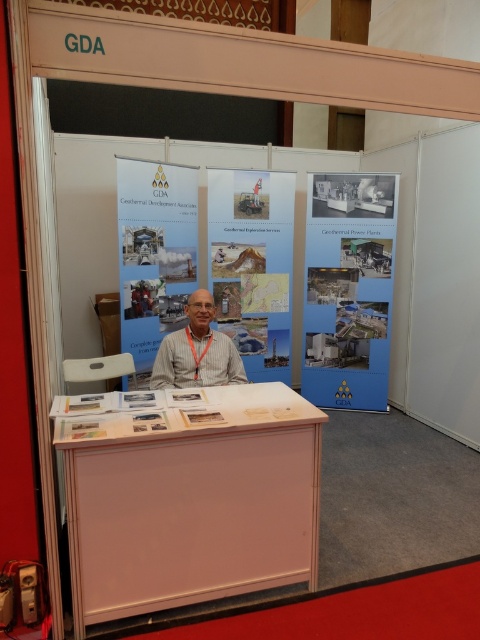
Question: Is white wood information desk at center below white striped shirt at center?

Choices:
 (A) yes
 (B) no

Answer: (A)

Question: Which object is farther from the camera taking this photo?

Choices:
 (A) matte paper poster at center
 (B) blue paperboard at center
 (C) blue paper at center
 (D) white paper at center

Answer: (C)

Question: Is blue paperboard at center closer to camera compared to blue paper at center?

Choices:
 (A) yes
 (B) no

Answer: (A)

Question: Observing the image, what is the correct spatial positioning of blue paperboard at center in reference to matte paper poster at center?

Choices:
 (A) above
 (B) below

Answer: (B)

Question: Which object appears farthest from the camera in this image?

Choices:
 (A) blue paperboard at center
 (B) white wood information desk at center

Answer: (A)

Question: Considering the real-world distances, which object is closest to the white wood information desk at center?

Choices:
 (A) white paper at center
 (B) white striped shirt at center
 (C) blue paper at center
 (D) blue paperboard at center

Answer: (B)